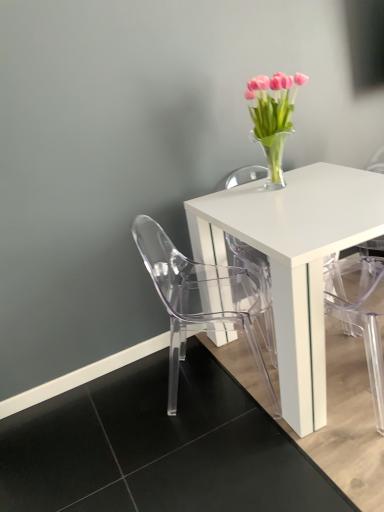
What do you see at coordinates (199, 301) in the screenshot? This screenshot has width=384, height=512. I see `transparent plastic chair at lower left` at bounding box center [199, 301].

You are a GUI agent. You are given a task and a screenshot of the screen. Output one action in this format:
    pyautogui.click(x=<x>, y=<y>)
    Task: Click on the transparent plastic armchair at lower right
    Image resolution: width=384 pixels, height=512 pixels.
    Given the screenshot: What is the action you would take?
    pos(360,314)

Identify the location of white glossy table at center. Image resolution: width=384 pixels, height=512 pixels. (295, 261).

How different are the orientations of transparent plastic armchair at lower right and transparent plastic chair at lower left in degrees?

The angle between the facing direction of transparent plastic armchair at lower right and the facing direction of transparent plastic chair at lower left is 126 degrees.

From the image's perspective, between transparent plastic armchair at lower right and transparent plastic chair at lower left, which one is located above?

transparent plastic armchair at lower right.

Which is behind, transparent plastic armchair at lower right or transparent plastic chair at lower left?

transparent plastic chair at lower left.

Is transparent plastic armchair at lower right aimed at transparent plastic chair at lower left?

No, transparent plastic armchair at lower right is not oriented towards transparent plastic chair at lower left.

Is transparent plastic chair at lower left not within white glossy table at center?

transparent plastic chair at lower left is positioned outside white glossy table at center.

Is transparent plastic chair at lower left in front of or behind white glossy table at center in the image?

transparent plastic chair at lower left is behind white glossy table at center.

Considering the relative sizes of transparent plastic chair at lower left and white glossy table at center in the image provided, is transparent plastic chair at lower left smaller than white glossy table at center?

Yes, transparent plastic chair at lower left is smaller than white glossy table at center.

How different are the orientations of transparent plastic chair at lower left and white glossy table at center in degrees?

The angular difference between transparent plastic chair at lower left and white glossy table at center is 59.3 degrees.

Which object is closer to the camera, transparent plastic chair at lower left or transparent plastic armchair at lower right?

transparent plastic armchair at lower right.

Is transparent plastic chair at lower left inside or outside of transparent plastic armchair at lower right?

transparent plastic chair at lower left lies outside transparent plastic armchair at lower right.

Does transparent plastic chair at lower left have a greater height compared to transparent plastic armchair at lower right?

No.

Is transparent plastic chair at lower left bigger or smaller than pink glass vase at upper right?

transparent plastic chair at lower left is bigger than pink glass vase at upper right.

The width and height of the screenshot is (384, 512). I want to click on chair below the pink glass vase at upper right (from a real-world perspective), so click(x=199, y=301).

Is transparent plastic chair at lower left surrounding pink glass vase at upper right?

That's incorrect, pink glass vase at upper right is not inside transparent plastic chair at lower left.

Is transparent plastic chair at lower left to the left of pink glass vase at upper right from the viewer's perspective?

Yes.

Is transparent plastic armchair at lower right positioned far away from pink glass vase at upper right?

No, transparent plastic armchair at lower right is not far away from pink glass vase at upper right.

From the image's perspective, which one is positioned higher, transparent plastic armchair at lower right or pink glass vase at upper right?

pink glass vase at upper right is shown above in the image.

Is point (381, 271) farther from viewer compared to point (277, 172)?

Yes.

Is the position of transparent plastic armchair at lower right more distant than that of white glossy table at center?

No, transparent plastic armchair at lower right is closer to the camera.

Between transparent plastic armchair at lower right and white glossy table at center, which one appears on the left side from the viewer's perspective?

white glossy table at center.

Is white glossy table at center inside transparent plastic armchair at lower right?

No, white glossy table at center is located outside of transparent plastic armchair at lower right.

Is transparent plastic armchair at lower right shorter than white glossy table at center?

No.

Looking at this image, does pink glass vase at upper right have a smaller size compared to transparent plastic chair at lower left?

Yes.

From the image's perspective, does pink glass vase at upper right appear lower than transparent plastic chair at lower left?

Incorrect, from the image's perspective, pink glass vase at upper right is higher than transparent plastic chair at lower left.

Could transparent plastic chair at lower left be considered to be inside pink glass vase at upper right?

No, pink glass vase at upper right does not contain transparent plastic chair at lower left.

Is pink glass vase at upper right taller than transparent plastic chair at lower left?

No, pink glass vase at upper right is not taller than transparent plastic chair at lower left.

The width and height of the screenshot is (384, 512). Find the location of `chair on the left of transparent plastic armchair at lower right`. chair on the left of transparent plastic armchair at lower right is located at coordinates (199, 301).

Locate an element on the screen. The height and width of the screenshot is (512, 384). chair located below the white glossy table at center (from the image's perspective) is located at coordinates (199, 301).

Looking at the image, which one is located further to transparent plastic chair at lower left, transparent plastic armchair at lower right or pink glass vase at upper right?

pink glass vase at upper right lies further to transparent plastic chair at lower left than the other object.

When comparing their distances from transparent plastic chair at lower left, does white glossy table at center or pink glass vase at upper right seem further?

Among the two, pink glass vase at upper right is located further to transparent plastic chair at lower left.

When comparing their distances from white glossy table at center, does pink glass vase at upper right or transparent plastic chair at lower left seem further?

pink glass vase at upper right is positioned further to the anchor white glossy table at center.

From the image, which object appears to be nearer to pink glass vase at upper right, transparent plastic armchair at lower right or white glossy table at center?

white glossy table at center is positioned closer to the anchor pink glass vase at upper right.

Which object lies nearer to the anchor point pink glass vase at upper right, white glossy table at center or transparent plastic armchair at lower right?

white glossy table at center is closer to pink glass vase at upper right.

Estimate the real-world distances between objects in this image. Which object is further from white glossy table at center, transparent plastic armchair at lower right or pink glass vase at upper right?

transparent plastic armchair at lower right.

Which object lies nearer to the anchor point transparent plastic chair at lower left, pink glass vase at upper right or transparent plastic armchair at lower right?

transparent plastic armchair at lower right.

Estimate the real-world distances between objects in this image. Which object is closer to transparent plastic chair at lower left, white glossy table at center or transparent plastic armchair at lower right?

Among the two, white glossy table at center is located nearer to transparent plastic chair at lower left.

Image resolution: width=384 pixels, height=512 pixels. In order to click on table that lies between pink glass vase at upper right and transparent plastic chair at lower left from top to bottom in this screenshot , I will do `click(295, 261)`.

Find the location of `table between transparent plastic chair at lower left and transparent plastic armchair at lower right from left to right`. table between transparent plastic chair at lower left and transparent plastic armchair at lower right from left to right is located at coordinates (295, 261).

At what (x,y) coordinates should I click in order to perform the action: click on armchair that lies between pink glass vase at upper right and transparent plastic chair at lower left from top to bottom. Please return your answer as a coordinate pair (x, y). The image size is (384, 512). Looking at the image, I should click on (360, 314).

The width and height of the screenshot is (384, 512). Identify the location of table between pink glass vase at upper right and transparent plastic armchair at lower right in the up-down direction. (295, 261).